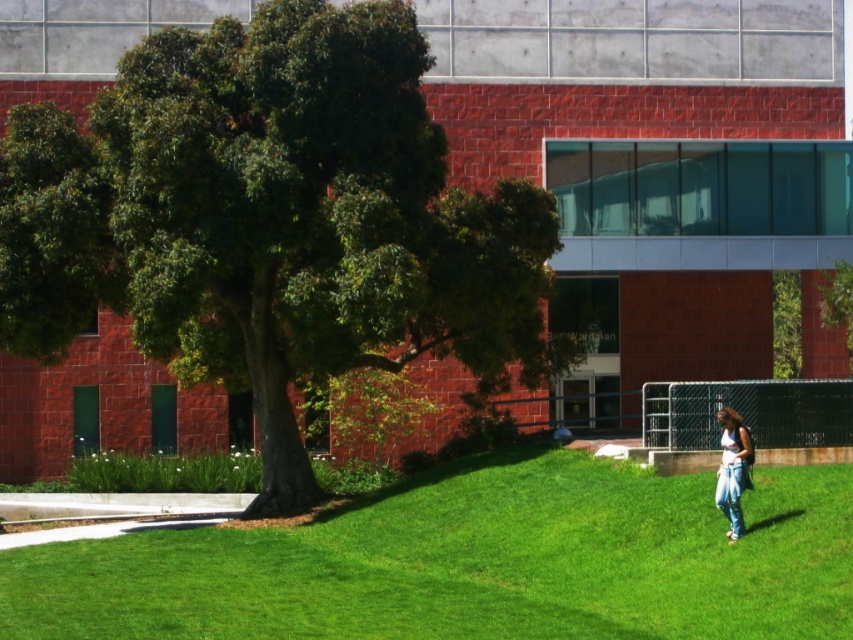
You are standing in the park and see the green leafy tree at center and the jeans at lower right. Which object is taller?

The green leafy tree at center is much taller than the jeans at lower right.